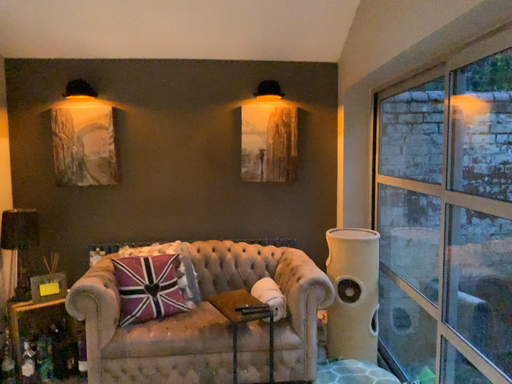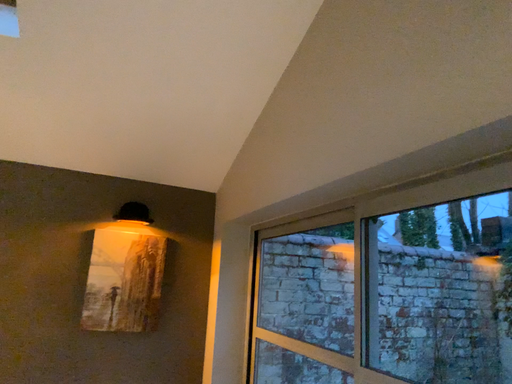
Question: How did the camera likely rotate when shooting the video?

Choices:
 (A) rotated upward
 (B) rotated downward

Answer: (A)